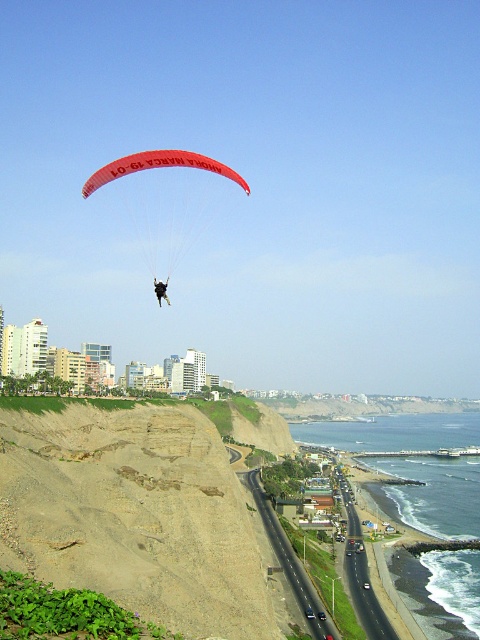
You are standing on the cliff overlooking the coast and see the red nylon parachute at center. If you want to take a photo of it with your smartphone, will it appear large enough in the frame?

The red nylon parachute at center is 126.23 meters away from the viewer. At this distance, the smartphone camera may struggle to capture the parachute clearly or make it appear large in the frame without zooming. Consider using a zoom lens or moving closer for a better shot.

You are a pilot observing two parachutes in the sky. The red nylon parachute at center and the black fabric parachute at upper center. Which parachute is closer to you?

The red nylon parachute at center is closer to you because it is further to the viewer than the black fabric parachute at upper center.

You are a photographer trying to capture the paraglider scene. You notice the red nylon parachute at center and the black fabric parachute at upper center. Which parachute should you focus on to get a wider shot without zooming in?

The red nylon parachute at center should be focused on because its width is larger than the black fabric parachute at upper center, making it easier to capture in a wider shot without zooming in.